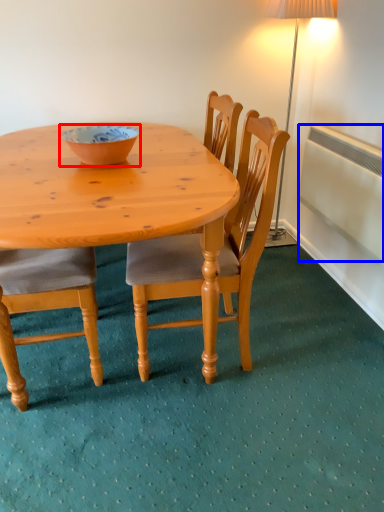
Question: Which object appears closest to the camera in this image, bowl (highlighted by a red box) or radiator (highlighted by a blue box)?

Choices:
 (A) bowl
 (B) radiator

Answer: (A)